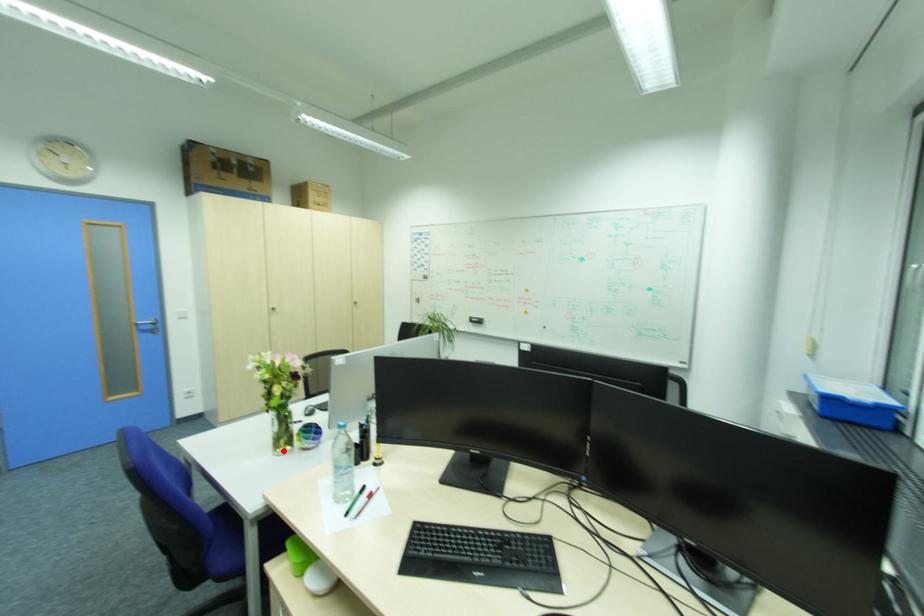
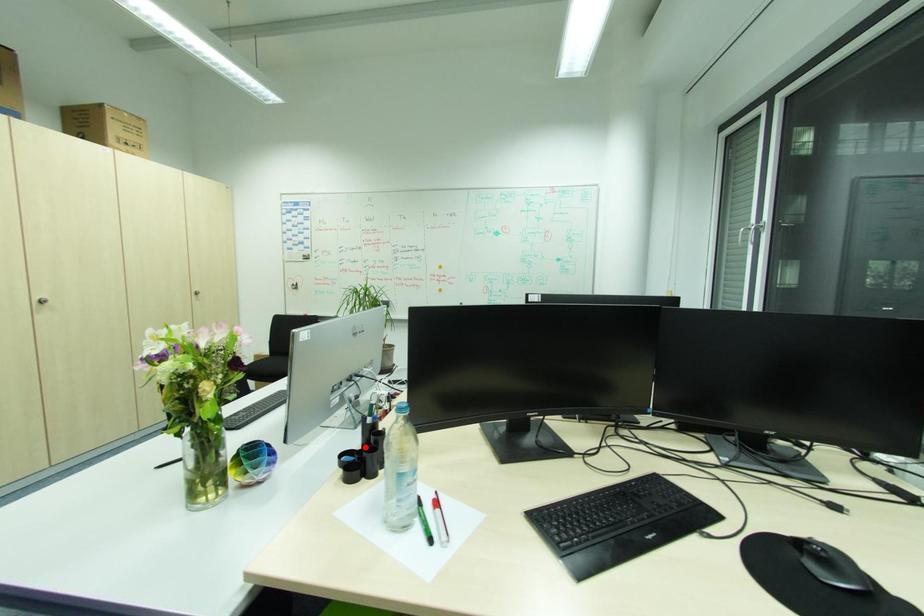
I am providing you with two images of the same scene from different viewpoints. A red point is marked on the first image and another point is marked on the second image. Does the point marked in image1 correspond to the same location as the one in image2?

No